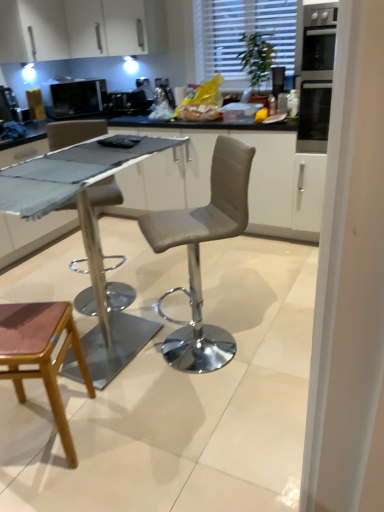
This screenshot has width=384, height=512. I want to click on unoccupied region to the right of pink leather stool at lower left, so click(127, 428).